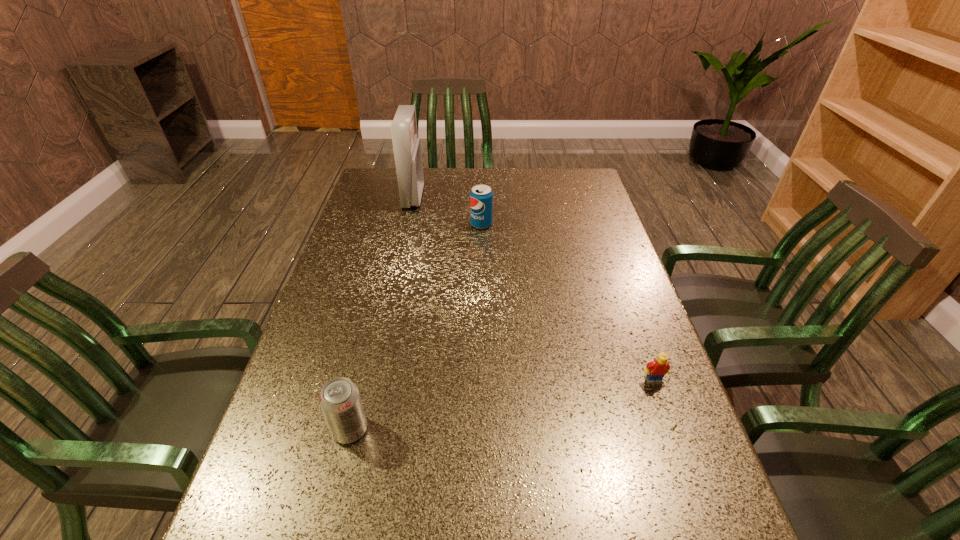
Image resolution: width=960 pixels, height=540 pixels. Find the location of `free space between the nearer soda can and the right soda can`. free space between the nearer soda can and the right soda can is located at coordinates tap(416, 327).

At what (x,y) coordinates should I click in order to perform the action: click on object that is the closest to the shortest object. Please return your answer as a coordinate pair (x, y). Looking at the image, I should click on (340, 401).

Locate an element on the screen. The height and width of the screenshot is (540, 960). object that is the third nearest to the third object from left to right is located at coordinates (340, 401).

You are a GUI agent. You are given a task and a screenshot of the screen. Output one action in this format:
    pyautogui.click(x=<x>, y=<y>)
    Task: Click on the vacant region that satisfies the following two spatial constraints: 1. on the front-facing side of the farther soda can; 2. on the right side of the tallest object
    This screenshot has height=540, width=960.
    Given the screenshot: What is the action you would take?
    pyautogui.click(x=407, y=225)

Identify the location of free space that satisfies the following two spatial constraints: 1. on the front-facing side of the first-aid kit; 2. on the left side of the farther soda can. (407, 225).

Identify the location of blank space that satisfies the following two spatial constraints: 1. on the front-facing side of the third object from left to right; 2. on the left side of the tallest object. The height and width of the screenshot is (540, 960). (407, 225).